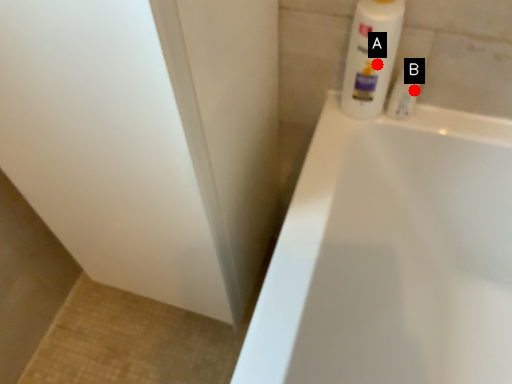
Question: Two points are circled on the image, labeled by A and B beside each circle. Which point appears farthest from the camera in this image?

Choices:
 (A) A is further
 (B) B is further

Answer: (B)